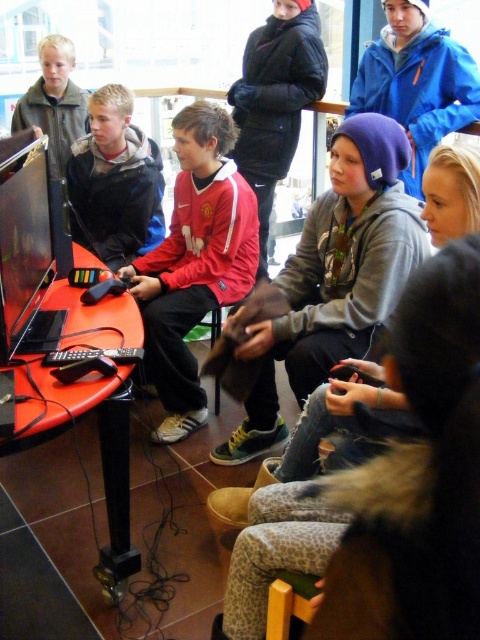
Question: Which point is farther to the camera?

Choices:
 (A) (96, 109)
 (B) (176, 285)
 (C) (388, 72)

Answer: (C)

Question: Which point is closer to the camera taking this photo?

Choices:
 (A) (128, 252)
 (B) (460, 115)

Answer: (B)

Question: Does red jersey at center appear under matte black jacket at center?

Choices:
 (A) no
 (B) yes

Answer: (B)

Question: Can you confirm if red jersey at center is smaller than blue fleece jacket at upper center?

Choices:
 (A) yes
 (B) no

Answer: (B)

Question: Which object appears farthest from the camera in this image?

Choices:
 (A) blue fleece jacket at upper center
 (B) matte black jacket at center
 (C) red jersey at center

Answer: (B)

Question: Is red jersey at center below blue fleece jacket at upper center?

Choices:
 (A) yes
 (B) no

Answer: (A)